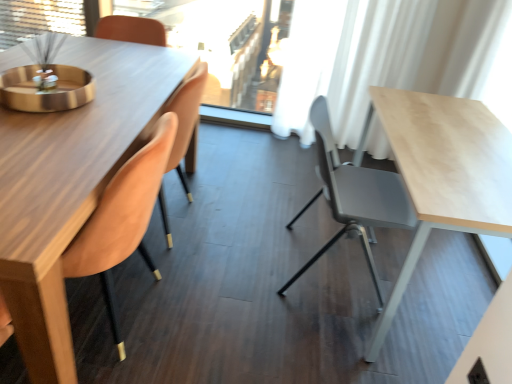
Identify the location of vacant space to the right of velvet orange chair at left, which appears as the 1th chair when viewed from the left. (224, 313).